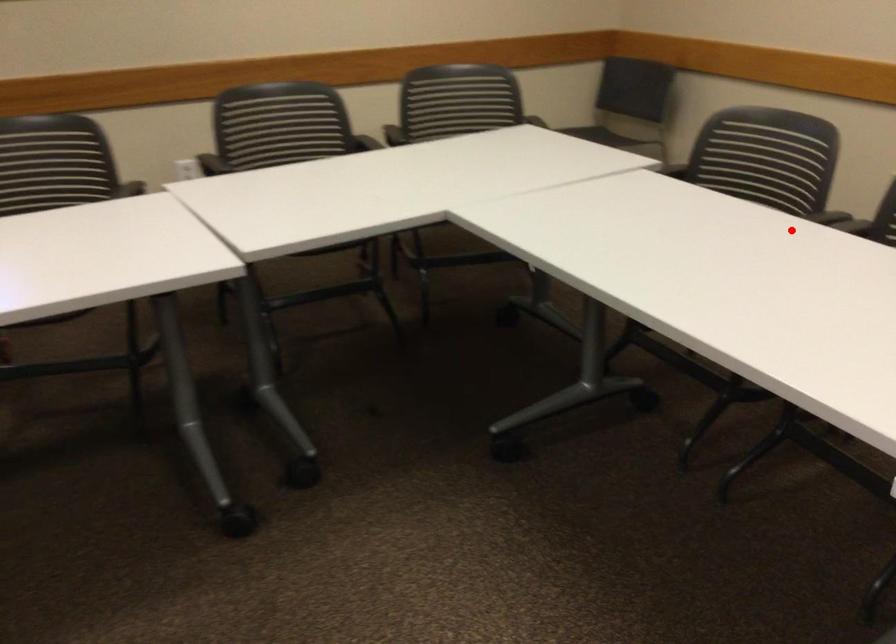
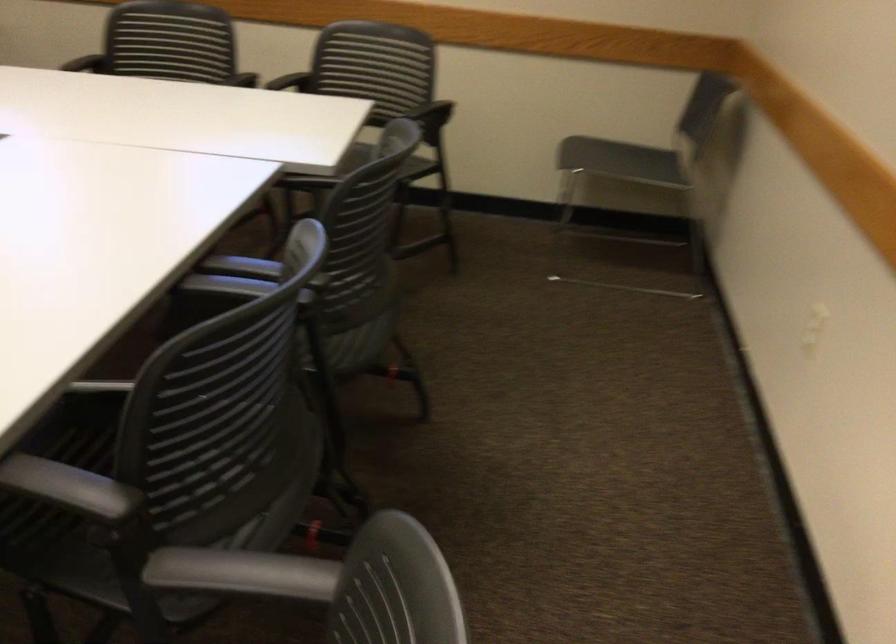
Find the pixel in the second image that matches the highlighted location in the first image.

(246, 274)